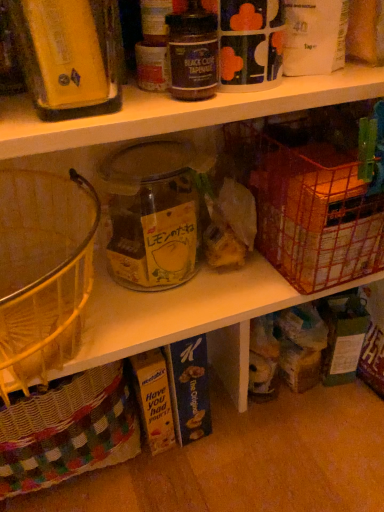
Image resolution: width=384 pixels, height=512 pixels. What do you see at coordinates (316, 215) in the screenshot?
I see `metallic wire basket at right` at bounding box center [316, 215].

Image resolution: width=384 pixels, height=512 pixels. Identify the location of transparent glass jar at center. (152, 215).

From the image's perspective, which is below, metallic wire basket at right or matte yellow container at upper left, the 1th bottle from the left?

From the image's view, metallic wire basket at right is below.

Looking at their sizes, would you say metallic wire basket at right is wider or thinner than matte yellow container at upper left, arranged as the 2th bottle when viewed from the right?

In the image, metallic wire basket at right appears to be wider than matte yellow container at upper left, arranged as the 2th bottle when viewed from the right.

Is metallic wire basket at right smaller than matte yellow container at upper left, arranged as the 2th bottle when viewed from the right?

Actually, metallic wire basket at right might be larger than matte yellow container at upper left, arranged as the 2th bottle when viewed from the right.

How different are the orientations of transparent glass jar at center and black glass jar at upper center, the 1th bottle when ordered from right to left, in degrees?

transparent glass jar at center and black glass jar at upper center, the 1th bottle when ordered from right to left, are facing 3.27 degrees away from each other.

Could black glass jar at upper center, which ranks as the 2th bottle in left-to-right order, be considered to be inside transparent glass jar at center?

Actually, black glass jar at upper center, which ranks as the 2th bottle in left-to-right order, is outside transparent glass jar at center.

Which is more to the right, transparent glass jar at center or black glass jar at upper center, the 1th bottle when ordered from right to left?

Positioned to the right is black glass jar at upper center, the 1th bottle when ordered from right to left.

Is point (164, 207) behind point (170, 34)?

Yes, point (164, 207) is farther from viewer.

From a real-world perspective, which is physically below, matte yellow container at upper left, the 1th bottle from the left, or black glass jar at upper center, the 1th bottle when ordered from right to left?

From a 3D spatial view, black glass jar at upper center, the 1th bottle when ordered from right to left, is below.

Is the surface of matte yellow container at upper left, arranged as the 2th bottle when viewed from the right, in direct contact with black glass jar at upper center, the 1th bottle when ordered from right to left?

No, matte yellow container at upper left, arranged as the 2th bottle when viewed from the right, is not making contact with black glass jar at upper center, the 1th bottle when ordered from right to left.

Considering the positions of point (23, 11) and point (217, 46), is point (23, 11) closer or farther from the camera than point (217, 46)?

Point (23, 11) is positioned closer to the camera compared to point (217, 46).

From a real-world perspective, is matte yellow container at upper left, the 1th bottle from the left, under transparent glass jar at center?

No.

Is transparent glass jar at center at the back of matte yellow container at upper left, arranged as the 2th bottle when viewed from the right?

matte yellow container at upper left, arranged as the 2th bottle when viewed from the right, does not have its back to transparent glass jar at center.

Considering the positions of point (97, 70) and point (157, 157), is point (97, 70) closer or farther from the camera than point (157, 157)?

Point (97, 70) appears to be closer to the viewer than point (157, 157).

Can you confirm if matte yellow container at upper left, arranged as the 2th bottle when viewed from the right, is thinner than transparent glass jar at center?

Yes, matte yellow container at upper left, arranged as the 2th bottle when viewed from the right, is thinner than transparent glass jar at center.

Is metallic wire basket at right located within black glass jar at upper center, which ranks as the 2th bottle in left-to-right order?

No, black glass jar at upper center, which ranks as the 2th bottle in left-to-right order, does not contain metallic wire basket at right.

In the scene shown: Is the depth of black glass jar at upper center, the 1th bottle when ordered from right to left, greater than that of metallic wire basket at right?

No, it is not.

Find the location of a particular element. The width and height of the screenshot is (384, 512). bottle that is the 1st object located in front of the metallic wire basket at right is located at coordinates (192, 53).

Is black glass jar at upper center, which ranks as the 2th bottle in left-to-right order, located within metallic wire basket at right?

No, metallic wire basket at right does not contain black glass jar at upper center, which ranks as the 2th bottle in left-to-right order.

Can you confirm if metallic wire basket at right is shorter than black glass jar at upper center, the 1th bottle when ordered from right to left?

No.

From the image's perspective, between metallic wire basket at right and black glass jar at upper center, the 1th bottle when ordered from right to left, which one is located above?

From the image's view, black glass jar at upper center, the 1th bottle when ordered from right to left, is above.

Between metallic wire basket at right and black glass jar at upper center, the 1th bottle when ordered from right to left, which one has smaller width?

black glass jar at upper center, the 1th bottle when ordered from right to left, is thinner.

Considering the sizes of objects transparent glass jar at center and matte yellow container at upper left, arranged as the 2th bottle when viewed from the right, in the image provided, who is taller, transparent glass jar at center or matte yellow container at upper left, arranged as the 2th bottle when viewed from the right,?

transparent glass jar at center.

Are transparent glass jar at center and matte yellow container at upper left, the 1th bottle from the left, making contact?

No, transparent glass jar at center is not touching matte yellow container at upper left, the 1th bottle from the left.

Can we say transparent glass jar at center lies outside matte yellow container at upper left, arranged as the 2th bottle when viewed from the right?

Yes, transparent glass jar at center is located beyond the bounds of matte yellow container at upper left, arranged as the 2th bottle when viewed from the right.

Identify the location of basket below the matte yellow container at upper left, the 1th bottle from the left (from the image's perspective). The width and height of the screenshot is (384, 512). 316,215.

Identify the location of bottle on the right of transparent glass jar at center. (192, 53).

From the image, which object appears to be farther from matte yellow container at upper left, arranged as the 2th bottle when viewed from the right, transparent glass jar at center or metallic wire basket at right?

metallic wire basket at right.

When comparing their distances from matte yellow container at upper left, the 1th bottle from the left, does metallic wire basket at right or black glass jar at upper center, which ranks as the 2th bottle in left-to-right order, seem further?

metallic wire basket at right lies further to matte yellow container at upper left, the 1th bottle from the left, than the other object.

From the picture: Estimate the real-world distances between objects in this image. Which object is further from black glass jar at upper center, the 1th bottle when ordered from right to left, matte yellow container at upper left, arranged as the 2th bottle when viewed from the right, or transparent glass jar at center?

The object further to black glass jar at upper center, the 1th bottle when ordered from right to left, is transparent glass jar at center.

In the scene shown: Which object lies further to the anchor point transparent glass jar at center, metallic wire basket at right or matte yellow container at upper left, the 1th bottle from the left?

Based on the image, matte yellow container at upper left, the 1th bottle from the left, appears to be further to transparent glass jar at center.

Which object lies nearer to the anchor point matte yellow container at upper left, arranged as the 2th bottle when viewed from the right, transparent glass jar at center or black glass jar at upper center, which ranks as the 2th bottle in left-to-right order?

Based on the image, black glass jar at upper center, which ranks as the 2th bottle in left-to-right order, appears to be nearer to matte yellow container at upper left, arranged as the 2th bottle when viewed from the right.

When comparing their distances from metallic wire basket at right, does black glass jar at upper center, which ranks as the 2th bottle in left-to-right order, or transparent glass jar at center seem closer?

The object closer to metallic wire basket at right is transparent glass jar at center.

From the image, which object appears to be farther from matte yellow container at upper left, arranged as the 2th bottle when viewed from the right, metallic wire basket at right or transparent glass jar at center?

metallic wire basket at right is further to matte yellow container at upper left, arranged as the 2th bottle when viewed from the right.

From the picture: Estimate the real-world distances between objects in this image. Which object is closer to metallic wire basket at right, matte yellow container at upper left, arranged as the 2th bottle when viewed from the right, or black glass jar at upper center, the 1th bottle when ordered from right to left?

black glass jar at upper center, the 1th bottle when ordered from right to left, is closer to metallic wire basket at right.

In order to click on bottle between matte yellow container at upper left, the 1th bottle from the left, and metallic wire basket at right in this screenshot , I will do `click(192, 53)`.

The width and height of the screenshot is (384, 512). Find the location of `glass jar between matte yellow container at upper left, arranged as the 2th bottle when viewed from the right, and metallic wire basket at right`. glass jar between matte yellow container at upper left, arranged as the 2th bottle when viewed from the right, and metallic wire basket at right is located at coordinates (152, 215).

You are a GUI agent. You are given a task and a screenshot of the screen. Output one action in this format:
    pyautogui.click(x=<x>, y=<y>)
    Task: Click on the bottle between transparent glass jar at center and metallic wire basket at right
    This screenshot has width=384, height=512.
    Given the screenshot: What is the action you would take?
    pyautogui.click(x=192, y=53)

The height and width of the screenshot is (512, 384). In order to click on bottle between matte yellow container at upper left, arranged as the 2th bottle when viewed from the right, and transparent glass jar at center from front to back in this screenshot , I will do `click(192, 53)`.